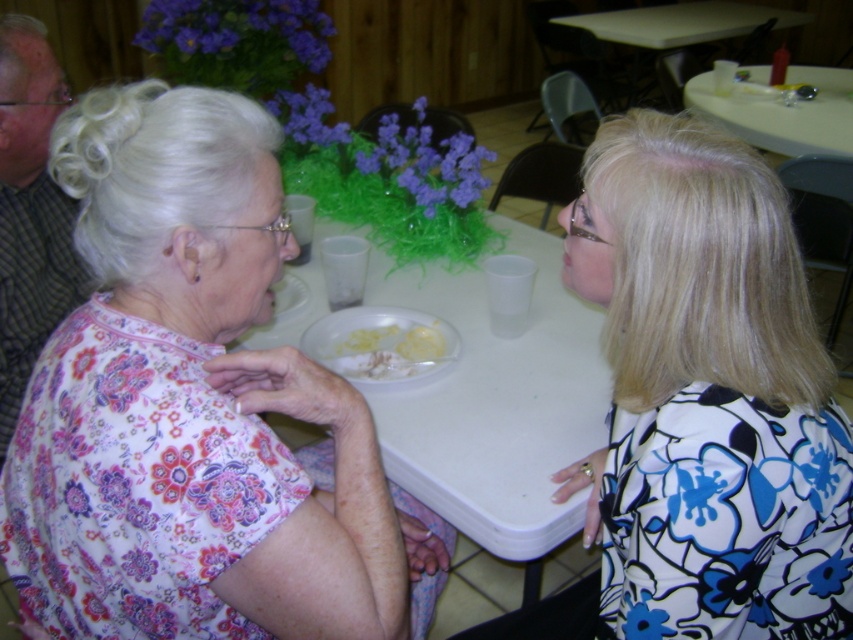
Which is above, gray striped shirt at left or white plastic table at upper right?

white plastic table at upper right is higher up.

How much distance is there between gray striped shirt at left and white plastic table at upper right?

They are 2.36 meters apart.

Is point (61, 264) less distant than point (688, 106)?

Yes, point (61, 264) is in front of point (688, 106).

The width and height of the screenshot is (853, 640). I want to click on gray striped shirt at left, so click(x=30, y=212).

Can you confirm if white plastic table at center is bigger than gray striped shirt at left?

Correct, white plastic table at center is larger in size than gray striped shirt at left.

Does white plastic table at center have a lesser height compared to gray striped shirt at left?

Yes.

Which is behind, point (560, 304) or point (21, 250)?

Point (560, 304)

In order to click on white plastic table at center in this screenshot , I will do `click(497, 403)`.

Between floral-patterned blouse at left and white creamy food at center, which one is positioned higher?

white creamy food at center is above.

From the picture: Is floral-patterned blouse at left further to the viewer compared to white creamy food at center?

No.

Is point (108, 381) closer to camera compared to point (364, 339)?

Yes, it is in front of point (364, 339).

What are the coordinates of `floral-patterned blouse at left` in the screenshot? It's located at (193, 408).